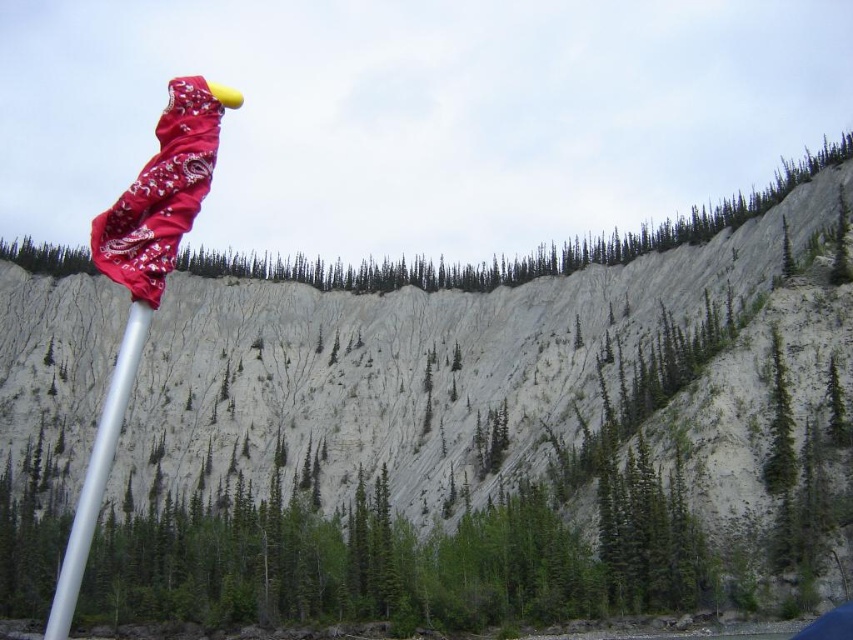
Is silver metallic pole at left closer to the viewer compared to green textured tree at center?

That is True.

Is point (126, 381) more distant than point (770, 484)?

No.

The width and height of the screenshot is (853, 640). Find the location of `silver metallic pole at left`. silver metallic pole at left is located at coordinates (97, 472).